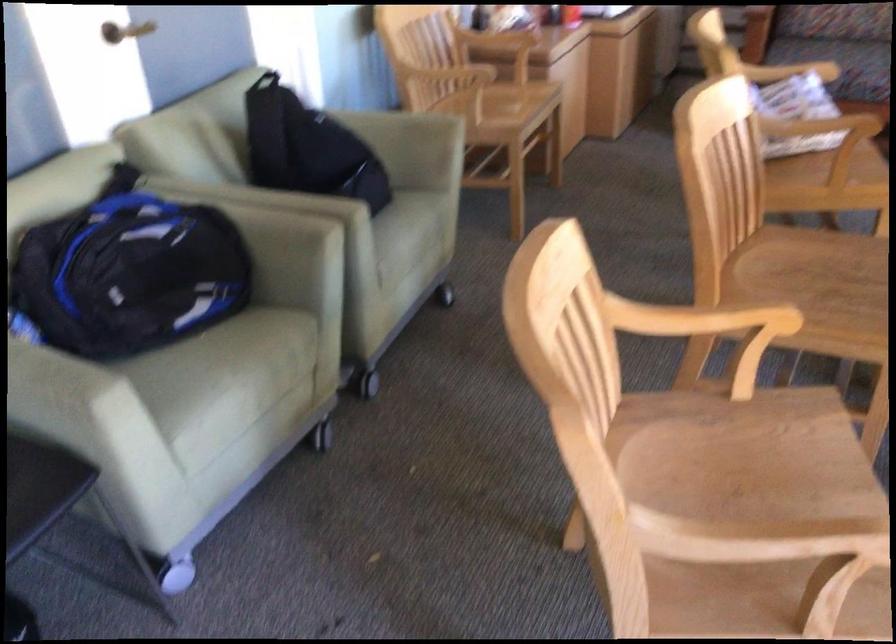
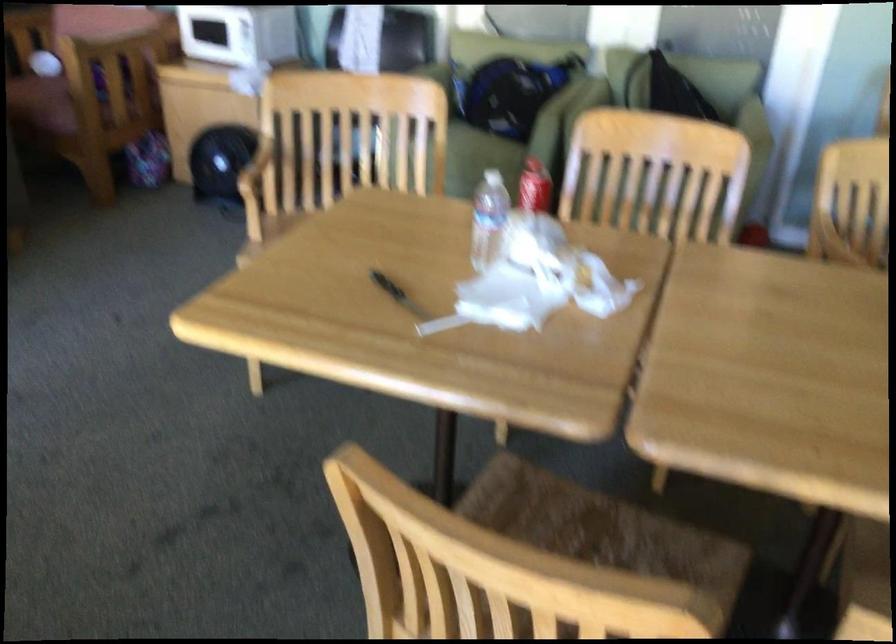
Question: I am providing you with two images of the same scene from different viewpoints. After the viewpoint changes to image2, which objects are now occluded?

Choices:
 (A) metal wall clip
 (B) sofa sitting surface
 (C) chair armrest
 (D) caster wheel

Answer: (D)